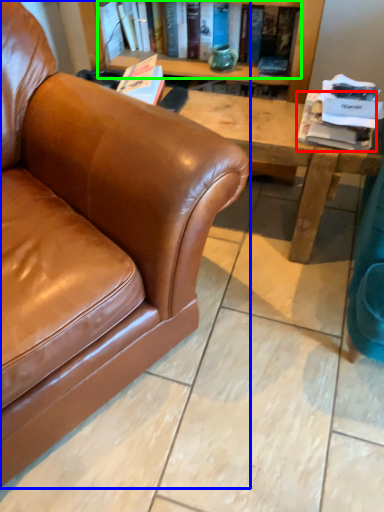
Question: Based on their relative distances, which object is farther from book (highlighted by a red box)? Choose from studio couch (highlighted by a blue box) and book (highlighted by a green box).

Choices:
 (A) studio couch
 (B) book

Answer: (A)